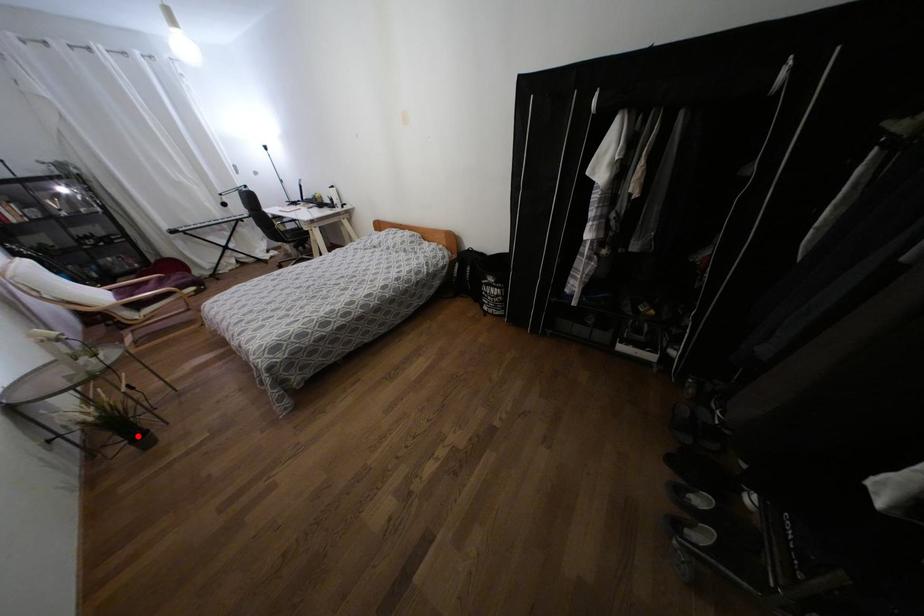
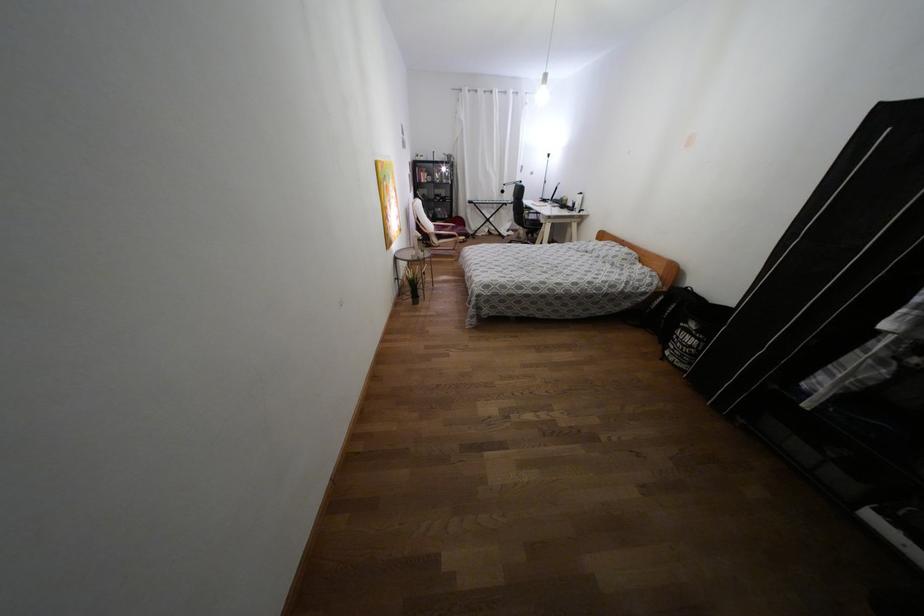
Question: I am providing you with two images of the same scene from different viewpoints. Given a red point in image1, look at the same physical point in image2. Is it:

Choices:
 (A) Closer to the viewpoint
 (B) Farther from the viewpoint

Answer: (B)